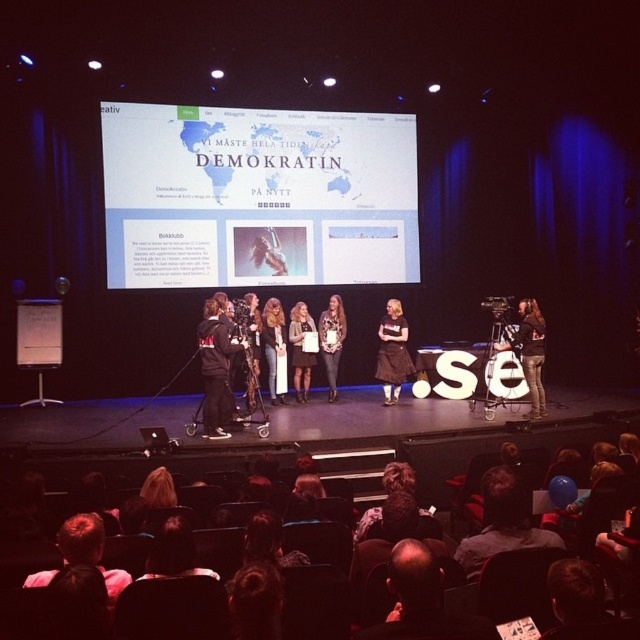
You are standing at the back of the conference hall and want to take a photo of the stage. The point at coordinates point (225, 419) is part of the stage setup. If your camera has a focal length of 50mm and you want to capture the entire stage including this point, what is the minimum distance you should maintain from the stage to ensure the point is in frame?

The point at coordinates point (225, 419) is 24.66 feet away from the camera. To ensure the entire stage including this point is captured, you should maintain a distance of at least 24.66 feet from the stage.

You are an event organizer standing at the back of the conference hall. You need to hand a microphone to the person wearing the dark gray hoodie at left. Can you reach them from your current position?

The dark gray hoodie at left is 7.22 meters away from the viewer. Since the event organizer is at the back of the conference hall, they are likely farther away than 7.22 meters, so they cannot reach the person directly and would need to use another method like a microphone stand or have someone else deliver it.

You are an attendee at the event and want to take a photo of the point at coordinates (257,196). Where should you position yourself to ensure the point is clearly visible in your photo?

The point at coordinates (257,196) is on the white paper at center, so you should position yourself facing the center of the stage where the white paper is located to ensure the point is clearly visible in your photo.